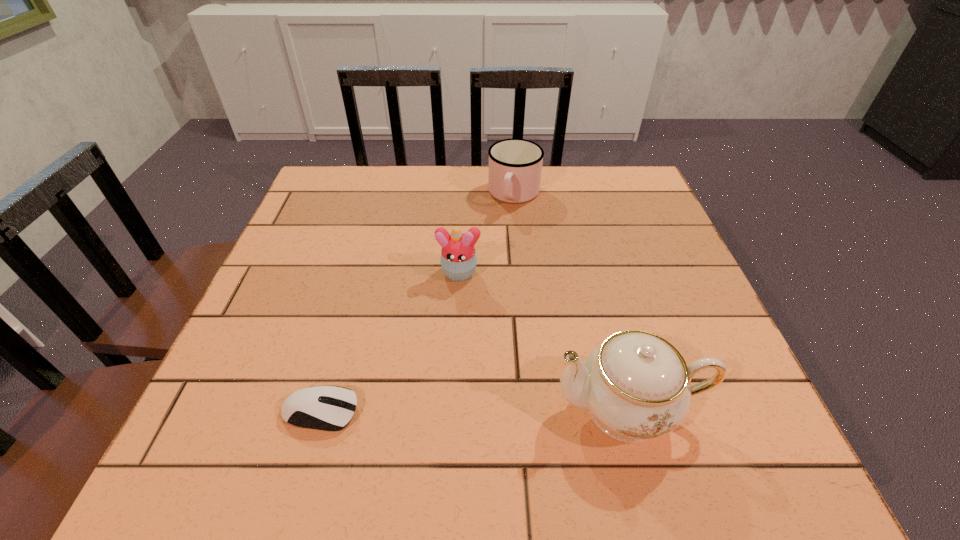
Identify the location of object positioned at the right edge. (636, 386).

Where is `object that is at the near left corner`? Image resolution: width=960 pixels, height=540 pixels. object that is at the near left corner is located at coordinates (317, 407).

You are a GUI agent. You are given a task and a screenshot of the screen. Output one action in this format:
    pyautogui.click(x=<x>, y=<y>)
    Task: Click on the object that is at the near right corner
    This screenshot has height=540, width=960.
    Given the screenshot: What is the action you would take?
    pyautogui.click(x=636, y=386)

At what (x,y) coordinates should I click in order to perform the action: click on free space at the far edge of the desktop. Please return your answer as a coordinate pair (x, y). This screenshot has width=960, height=540. Looking at the image, I should click on (485, 170).

Locate an element on the screen. This screenshot has height=540, width=960. free point at the near edge is located at coordinates (539, 413).

Locate an element on the screen. vacant space at the left edge of the desktop is located at coordinates tap(285, 302).

The image size is (960, 540). Find the location of `free region at the right edge`. free region at the right edge is located at coordinates (662, 221).

In the image, there is a desktop. Identify the location of vacant space at the far left corner. Image resolution: width=960 pixels, height=540 pixels. (326, 180).

Find the location of a particular element. vacant space at the far right corner is located at coordinates pos(589,183).

This screenshot has height=540, width=960. What are the coordinates of `empty space that is in between the leftmost object and the farthest object` in the screenshot? It's located at (418, 303).